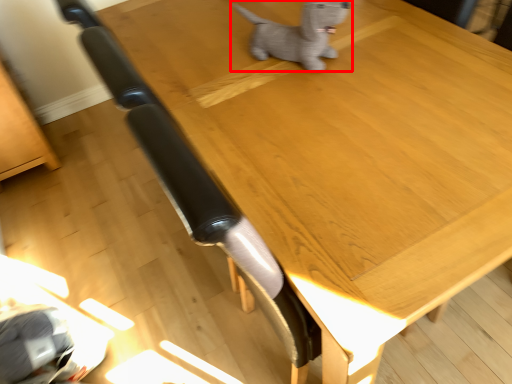
Question: Considering the relative positions of dog (annotated by the red box) and furniture in the image provided, where is dog (annotated by the red box) located with respect to the staircase?

Choices:
 (A) left
 (B) right

Answer: (B)